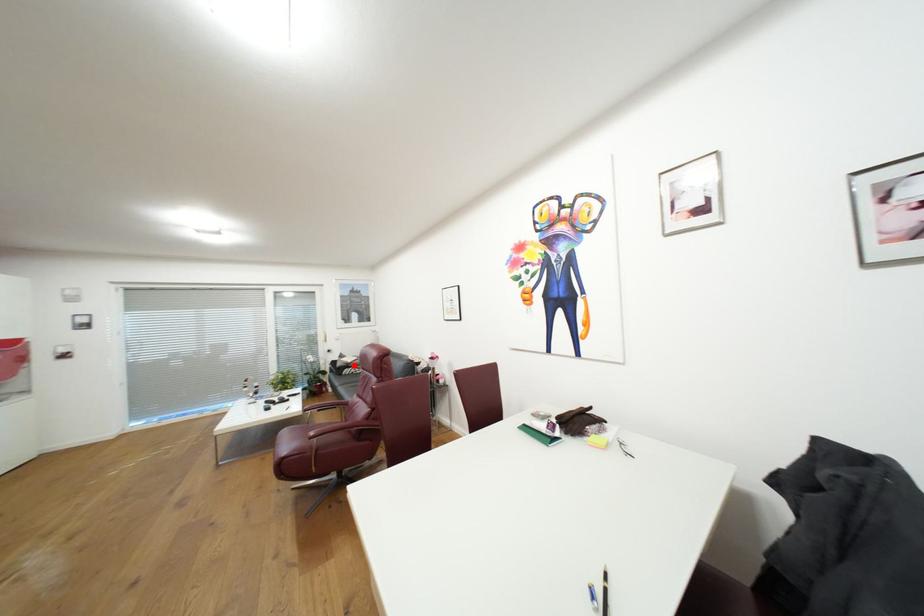
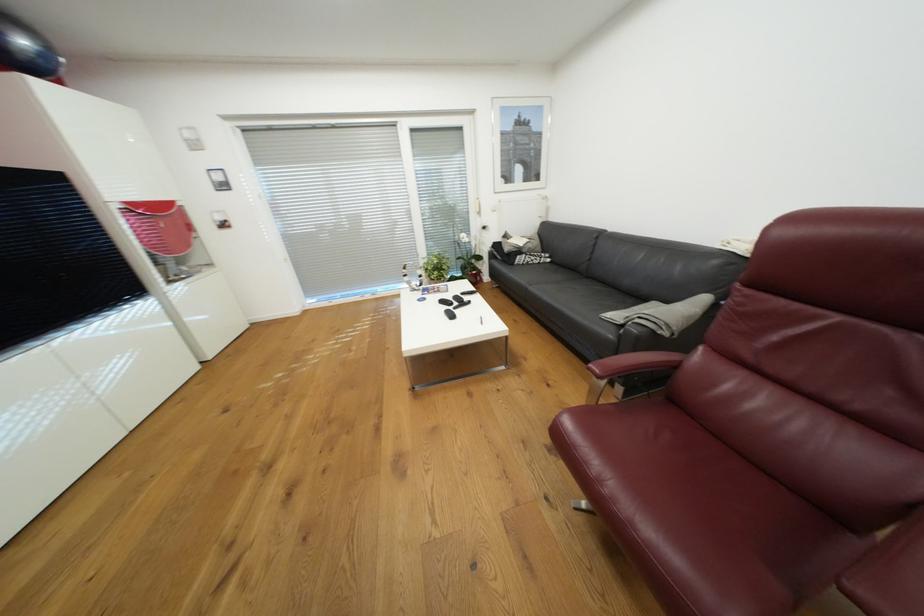
Question: I am providing you with two images of the same scene from different viewpoints. A red point is shown in image1. For the corresponding object point in image2, is it positioned nearer or farther from the camera?

Choices:
 (A) Nearer
 (B) Farther

Answer: (A)